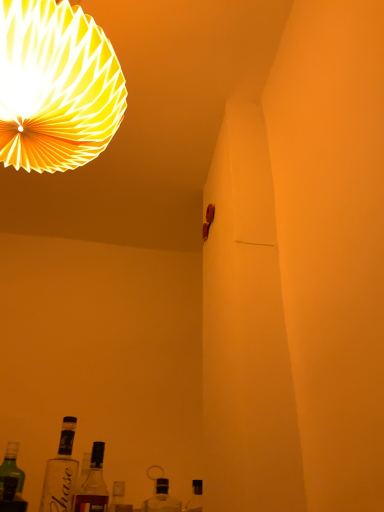
Question: From the image's perspective, would you say clear glass bottle at lower left, the 1th bottle positioned from the left, is shown under clear glass bottle at lower center, placed as the 3th bottle when sorted from left to right?

Choices:
 (A) no
 (B) yes

Answer: (A)

Question: Is clear glass bottle at lower left, the 1th bottle positioned from the left, not inside clear glass bottle at lower center, placed as the 3th bottle when sorted from left to right?

Choices:
 (A) yes
 (B) no

Answer: (A)

Question: Is clear glass bottle at lower left, the 1th bottle positioned from the left, to the right of clear glass bottle at lower center, placed as the 3th bottle when sorted from left to right, from the viewer's perspective?

Choices:
 (A) no
 (B) yes

Answer: (A)

Question: From a real-world perspective, is clear glass bottle at lower left, the 3th bottle viewed from the right, beneath clear glass bottle at lower center, placed as the 1th bottle when sorted from right to left?

Choices:
 (A) yes
 (B) no

Answer: (B)

Question: Considering the relative positions of clear glass bottle at lower left, the 3th bottle viewed from the right, and clear glass bottle at lower center, placed as the 1th bottle when sorted from right to left, in the image provided, is clear glass bottle at lower left, the 3th bottle viewed from the right, in front of clear glass bottle at lower center, placed as the 1th bottle when sorted from right to left,?

Choices:
 (A) yes
 (B) no

Answer: (A)

Question: Is clear glass bottle at lower center, placed as the 3th bottle when sorted from left to right, in front of or behind clear glass bottle at lower left, the 3th bottle viewed from the right, in the image?

Choices:
 (A) behind
 (B) front

Answer: (A)

Question: In the image, is clear glass bottle at lower center, placed as the 1th bottle when sorted from right to left, on the left side or the right side of clear glass bottle at lower left, the 3th bottle viewed from the right?

Choices:
 (A) left
 (B) right

Answer: (B)

Question: Choose the correct answer: Is clear glass bottle at lower center, placed as the 1th bottle when sorted from right to left, inside clear glass bottle at lower left, the 1th bottle positioned from the left, or outside it?

Choices:
 (A) inside
 (B) outside

Answer: (B)

Question: Considering the positions of clear glass bottle at lower center, placed as the 1th bottle when sorted from right to left, and clear glass bottle at lower left, the 3th bottle viewed from the right, in the image, is clear glass bottle at lower center, placed as the 1th bottle when sorted from right to left, taller or shorter than clear glass bottle at lower left, the 3th bottle viewed from the right,?

Choices:
 (A) tall
 (B) short

Answer: (B)

Question: Considering the positions of clear glass bottle at lower center, placed as the 1th bottle when sorted from right to left, and white paper lampshade at upper left in the image, is clear glass bottle at lower center, placed as the 1th bottle when sorted from right to left, taller or shorter than white paper lampshade at upper left?

Choices:
 (A) tall
 (B) short

Answer: (B)

Question: From a real-world perspective, is clear glass bottle at lower center, placed as the 3th bottle when sorted from left to right, above or below white paper lampshade at upper left?

Choices:
 (A) above
 (B) below

Answer: (B)

Question: Is point (157, 489) closer or farther from the camera than point (79, 41)?

Choices:
 (A) closer
 (B) farther

Answer: (B)

Question: Visually, is clear glass bottle at lower center, placed as the 3th bottle when sorted from left to right, positioned to the left or to the right of white paper lampshade at upper left?

Choices:
 (A) left
 (B) right

Answer: (B)

Question: From the image's perspective, relative to translucent glass bottle at lower center, which is the second bottle in right-to-left order, is clear glass bottle at lower center, placed as the 3th bottle when sorted from left to right, above or below?

Choices:
 (A) above
 (B) below

Answer: (B)

Question: Does point (152, 504) appear closer or farther from the camera than point (102, 463)?

Choices:
 (A) farther
 (B) closer

Answer: (B)